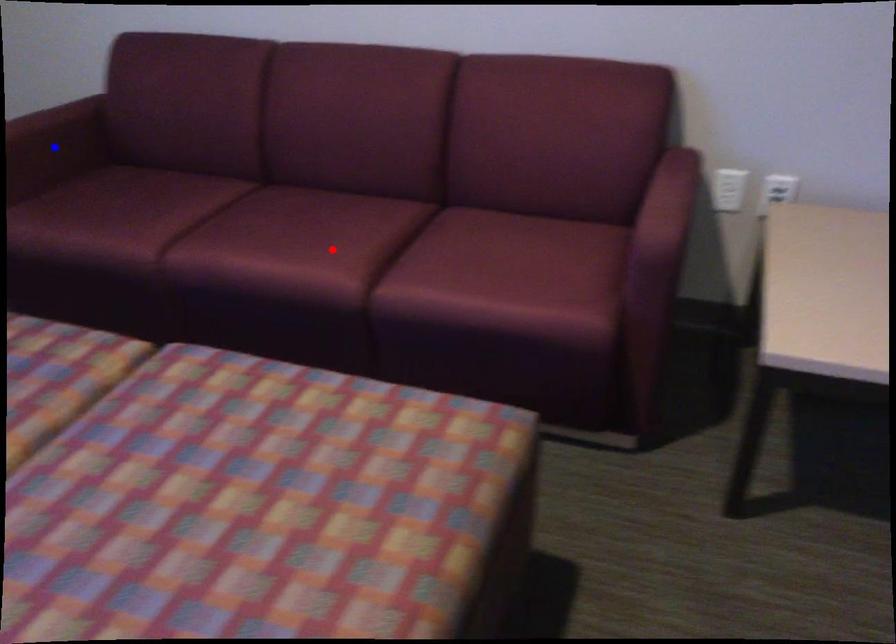
Question: Which of the two points in the image is closer to the camera?

Choices:
 (A) Blue point is closer.
 (B) Red point is closer.

Answer: (B)